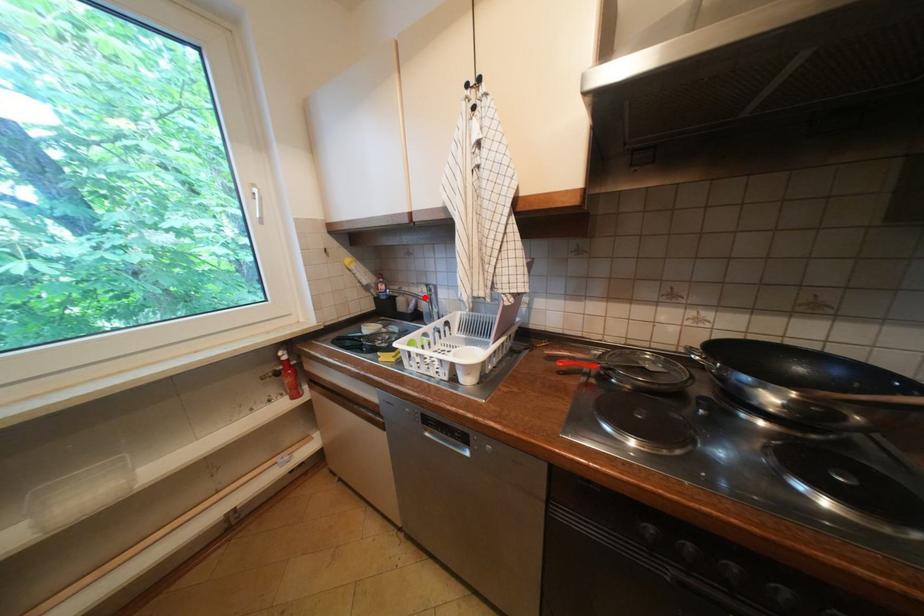
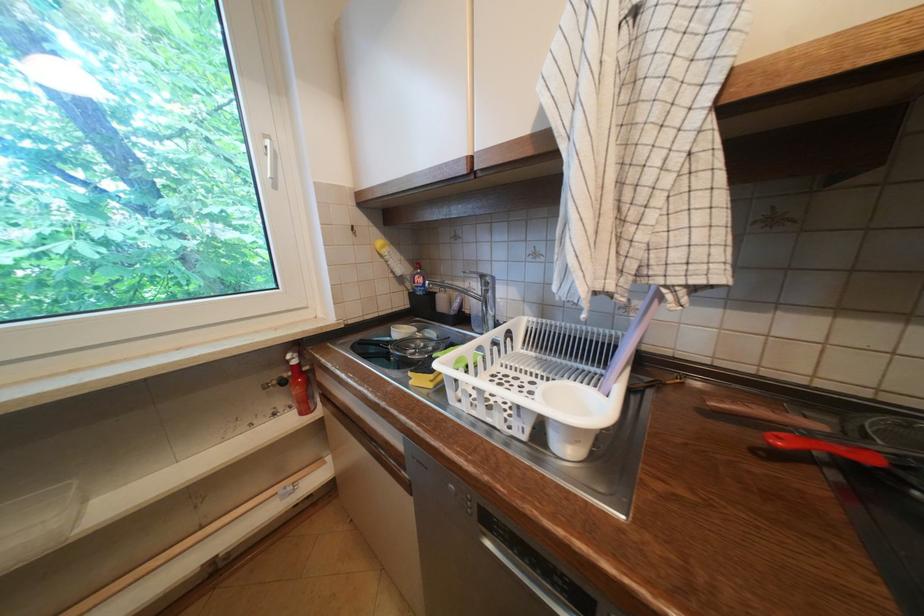
The point at the highlighted location is marked in the first image. Where is the corresponding point in the second image?

(473, 293)